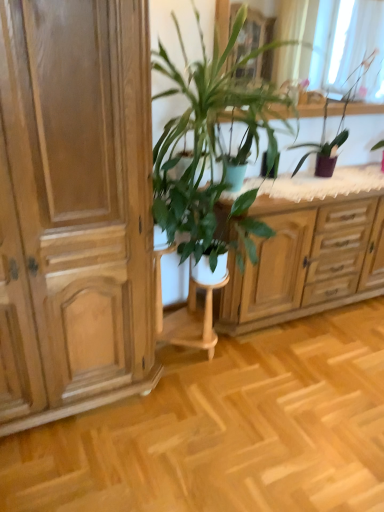
The image size is (384, 512). Identify the location of vacant point to the right of light brown wood cabinet at left. (216, 419).